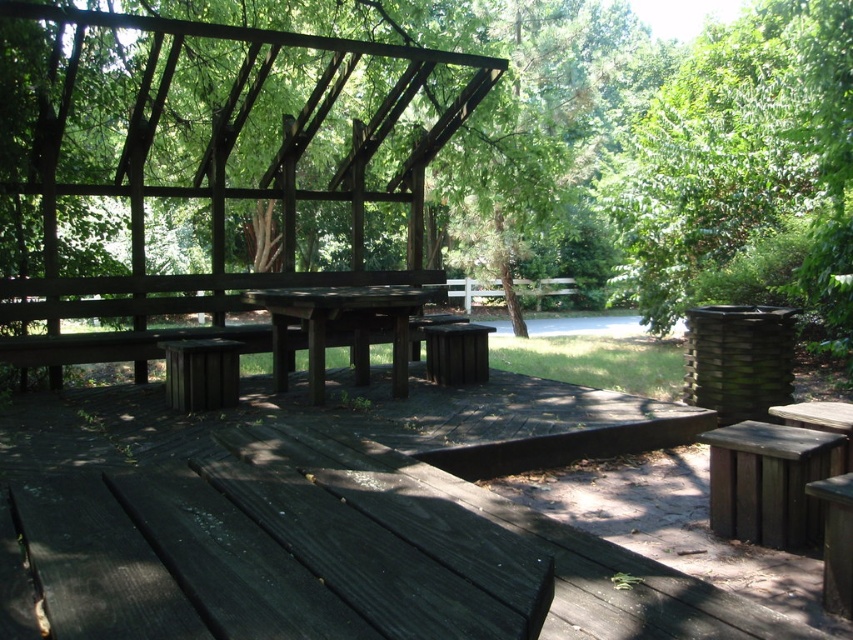
Question: Which object is positioned closest to the dark brown wood bench at lower right?

Choices:
 (A) dark brown wooden table at center
 (B) green leafy tree at upper right

Answer: (A)

Question: Which of the following is the farthest from the observer?

Choices:
 (A) dark wood picnic table at center
 (B) green leafy tree at upper right
 (C) dark brown wood bench at lower right
 (D) dark brown wooden table at center

Answer: (B)

Question: Can you confirm if dark wood picnic table at center is positioned below green leafy tree at upper right?

Choices:
 (A) yes
 (B) no

Answer: (A)

Question: Which of the following is the farthest from the observer?

Choices:
 (A) 648,225
 (B) 701,442
 (C) 438,396
 (D) 375,294

Answer: (A)

Question: Can you confirm if dark wood picnic table at center is positioned below dark brown wooden table at center?

Choices:
 (A) no
 (B) yes

Answer: (B)

Question: Is dark wood picnic table at center bigger than green leafy tree at upper right?

Choices:
 (A) yes
 (B) no

Answer: (B)